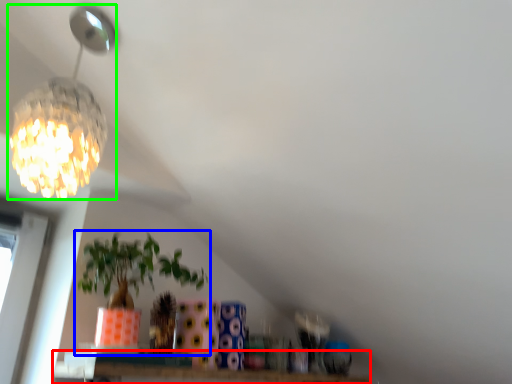
Question: Which object is the closest to the window (highlighted by a red box)? Choose among these: houseplant (highlighted by a blue box) or lamp (highlighted by a green box).

Choices:
 (A) houseplant
 (B) lamp

Answer: (A)